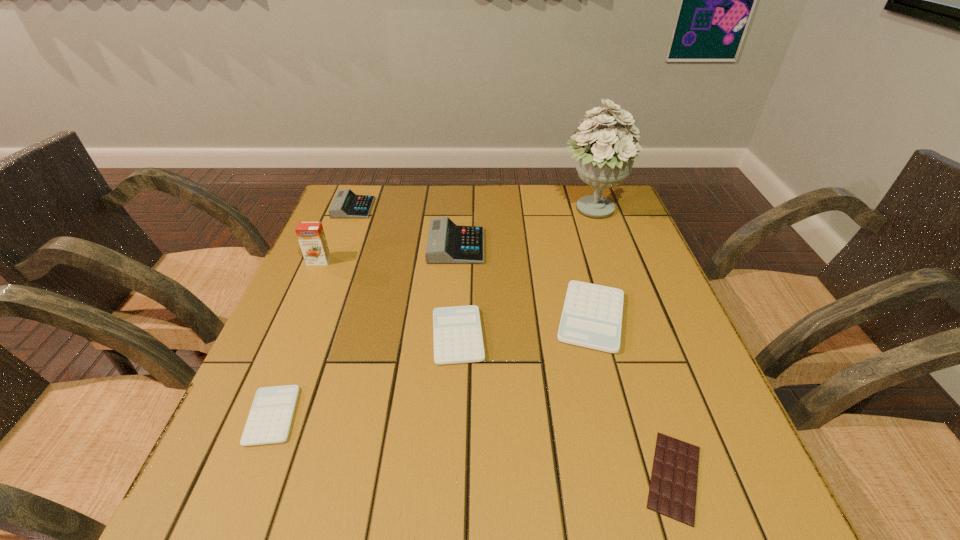
This screenshot has height=540, width=960. In order to click on chocolate bar present at the right edge in this screenshot , I will do click(x=673, y=486).

In order to click on object located at the far left corner in this screenshot , I will do `click(346, 204)`.

The image size is (960, 540). Identify the location of object that is positioned at the far right corner. (604, 159).

At what (x,y) coordinates should I click in order to perform the action: click on object at the near right corner. Please return your answer as a coordinate pair (x, y). The width and height of the screenshot is (960, 540). Looking at the image, I should click on (673, 486).

You are a GUI agent. You are given a task and a screenshot of the screen. Output one action in this format:
    pyautogui.click(x=<x>, y=<y>)
    Task: Click on the free space at the far edge of the desktop
    
    Given the screenshot: What is the action you would take?
    pyautogui.click(x=512, y=220)

Where is `vacant space at the near edge`? Image resolution: width=960 pixels, height=540 pixels. vacant space at the near edge is located at coordinates (456, 498).

You are a GUI agent. You are given a task and a screenshot of the screen. Output one action in this format:
    pyautogui.click(x=<x>, y=<y>)
    Task: Click on the vacant area at the left edge
    
    Given the screenshot: What is the action you would take?
    (x=367, y=268)

This screenshot has height=540, width=960. In the image, there is a desktop. In order to click on vacant area at the right edge in this screenshot , I will do `click(591, 247)`.

This screenshot has width=960, height=540. Find the location of `vacant space at the far right corner`. vacant space at the far right corner is located at coordinates (x=587, y=220).

Locate an element on the screen. The width and height of the screenshot is (960, 540). unoccupied area between the leftmost white calculator and the farther gray calculator is located at coordinates (313, 312).